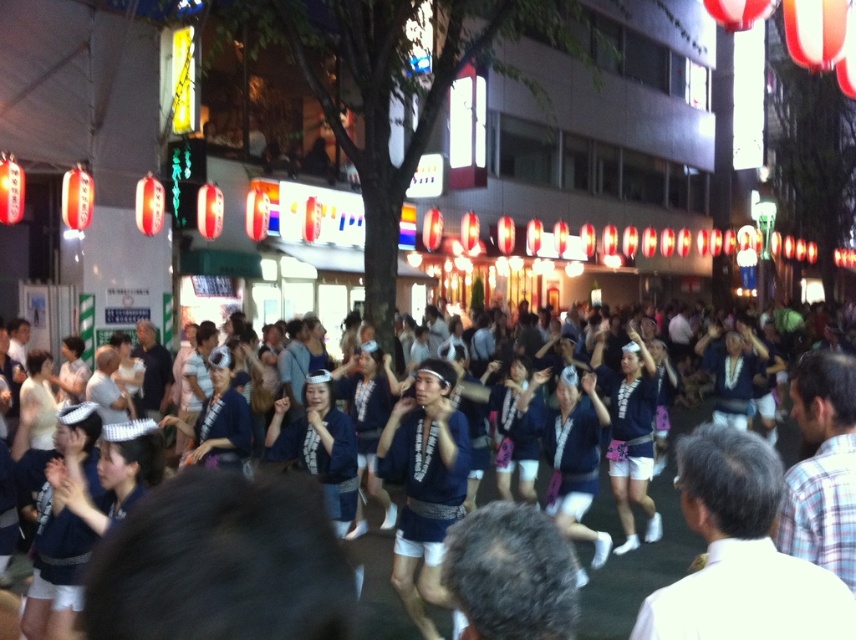
Where is `blue fabric at center`? This screenshot has width=856, height=640. blue fabric at center is located at coordinates (643, 552).

Is point (599, 624) positioned after point (446, 381)?

Yes, it is behind point (446, 381).

I want to click on blue fabric at center, so click(643, 552).

Can you confirm if white cotton shirt at center is shorter than matte blue kimono at center?

Yes, white cotton shirt at center is shorter than matte blue kimono at center.

Is point (834, 621) in front of point (635, 348)?

Yes, point (834, 621) is closer to viewer.

Where is `white cotton shirt at center`? Image resolution: width=856 pixels, height=640 pixels. white cotton shirt at center is located at coordinates pos(741,554).

Is white cotton shirt at center bigger than blue fabric at center?

Incorrect, white cotton shirt at center is not larger than blue fabric at center.

Does point (726, 628) lie behind point (599, 611)?

No, it is in front of (599, 611).

Identify the location of white cotton shirt at center. The image size is (856, 640). (741, 554).